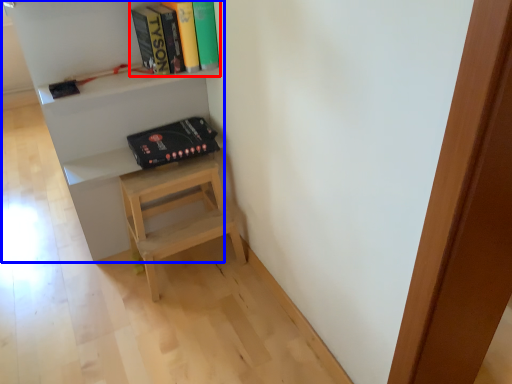
Question: Which of the following is the closest to the observer, book (highlighted by a red box) or shelf (highlighted by a blue box)?

Choices:
 (A) book
 (B) shelf

Answer: (B)